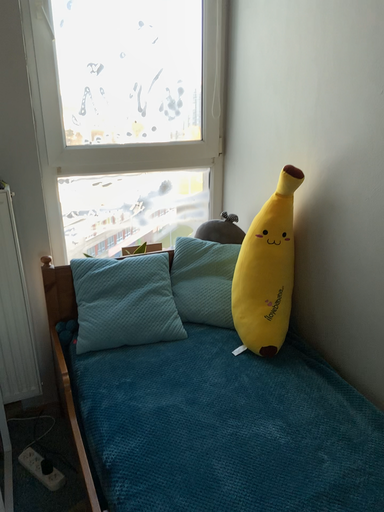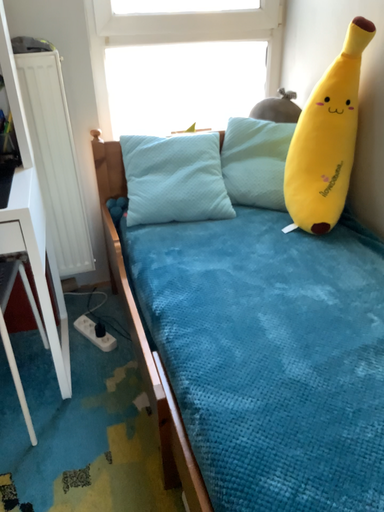
Question: How did the camera likely rotate when shooting the video?

Choices:
 (A) rotated left
 (B) rotated right

Answer: (A)